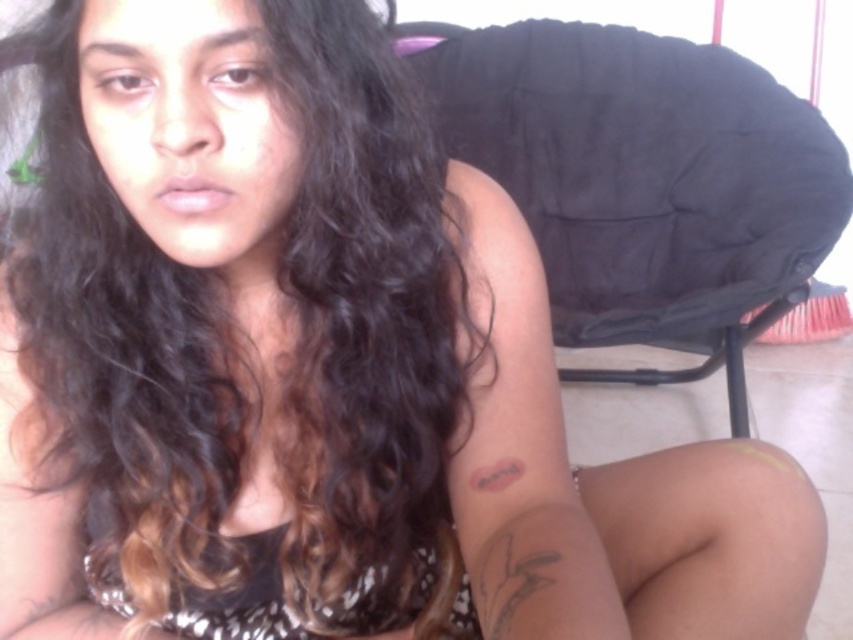
Question: Which point is closer to the camera taking this photo?

Choices:
 (A) (450, 538)
 (B) (505, 483)

Answer: (B)

Question: Which of these objects is positioned closest to the black sequined bikini top at lower left?

Choices:
 (A) black fabric chair at upper right
 (B) black ink tattoo at upper arm

Answer: (B)

Question: Is black fabric chair at upper right wider than black ink tattoo at upper arm?

Choices:
 (A) no
 (B) yes

Answer: (B)

Question: Which of the following is the farthest from the observer?

Choices:
 (A) (100, 600)
 (B) (474, 474)
 (C) (805, 211)

Answer: (C)

Question: Is black sequined bikini top at lower left bigger than black ink tattoo at upper arm?

Choices:
 (A) yes
 (B) no

Answer: (A)

Question: Is black fabric chair at upper right closer to camera compared to black ink tattoo at upper arm?

Choices:
 (A) no
 (B) yes

Answer: (A)